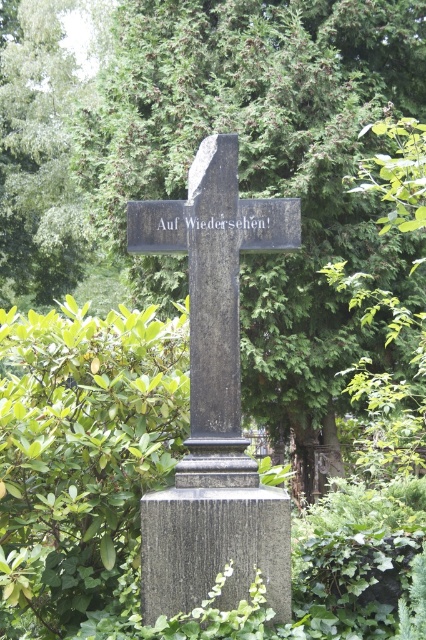
Based on the photo, you are a gardener who needs to trim the green leafy bush at center so it doesn t touch the black stone cross at center. What is the minimum distance you should keep between them?

The green leafy bush at center is currently 60.17 centimeters from the black stone cross at center. To ensure they don t touch, you should keep at least 60.17 centimeters between them.

You are standing in a cemetery and see the green leafy bush at center and the granite gravestone at center. Which object is positioned higher relative to the other?

The green leafy bush at center is positioned above the granite gravestone at center.

You are standing in front of the tombstone and want to place a flower at each of the two points marked. The first point is at coordinates point (345, 116) and the second at point (192, 413). Which point is closer to you when you are facing the tombstone?

Point (192, 413) is closer to you because it is less further to the camera than point (345, 116).